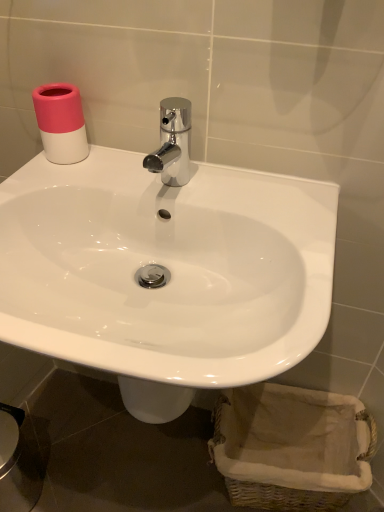
Question: From a real-world perspective, is white glossy sink at center beneath chrome metallic faucet at center?

Choices:
 (A) yes
 (B) no

Answer: (A)

Question: Can you confirm if white glossy sink at center is taller than chrome metallic faucet at center?

Choices:
 (A) yes
 (B) no

Answer: (A)

Question: Does white glossy sink at center come behind chrome metallic faucet at center?

Choices:
 (A) no
 (B) yes

Answer: (A)

Question: From the image's perspective, is white glossy sink at center beneath chrome metallic faucet at center?

Choices:
 (A) yes
 (B) no

Answer: (A)

Question: Can you confirm if white glossy sink at center is positioned to the left of chrome metallic faucet at center?

Choices:
 (A) no
 (B) yes

Answer: (B)

Question: Is point (167, 167) closer or farther from the camera than point (296, 400)?

Choices:
 (A) farther
 (B) closer

Answer: (B)

Question: In terms of size, does chrome metallic faucet at center appear bigger or smaller than woven beige basket at lower right?

Choices:
 (A) big
 (B) small

Answer: (B)

Question: In the image, is chrome metallic faucet at center on the left side or the right side of woven beige basket at lower right?

Choices:
 (A) left
 (B) right

Answer: (A)

Question: Is chrome metallic faucet at center situated inside woven beige basket at lower right or outside?

Choices:
 (A) outside
 (B) inside

Answer: (A)

Question: Considering the positions of point (256, 471) and point (162, 160), is point (256, 471) closer or farther from the camera than point (162, 160)?

Choices:
 (A) farther
 (B) closer

Answer: (B)

Question: In the image, is woven beige basket at lower right positioned in front of or behind chrome metallic faucet at center?

Choices:
 (A) front
 (B) behind

Answer: (B)

Question: Based on their positions, is woven beige basket at lower right located to the left or right of chrome metallic faucet at center?

Choices:
 (A) right
 (B) left

Answer: (A)

Question: From a real-world perspective, relative to chrome metallic faucet at center, is woven beige basket at lower right vertically above or below?

Choices:
 (A) below
 (B) above

Answer: (A)

Question: In terms of size, does chrome metallic faucet at center appear bigger or smaller than white glossy sink at center?

Choices:
 (A) big
 (B) small

Answer: (B)

Question: Is chrome metallic faucet at center inside the boundaries of white glossy sink at center, or outside?

Choices:
 (A) inside
 (B) outside

Answer: (B)